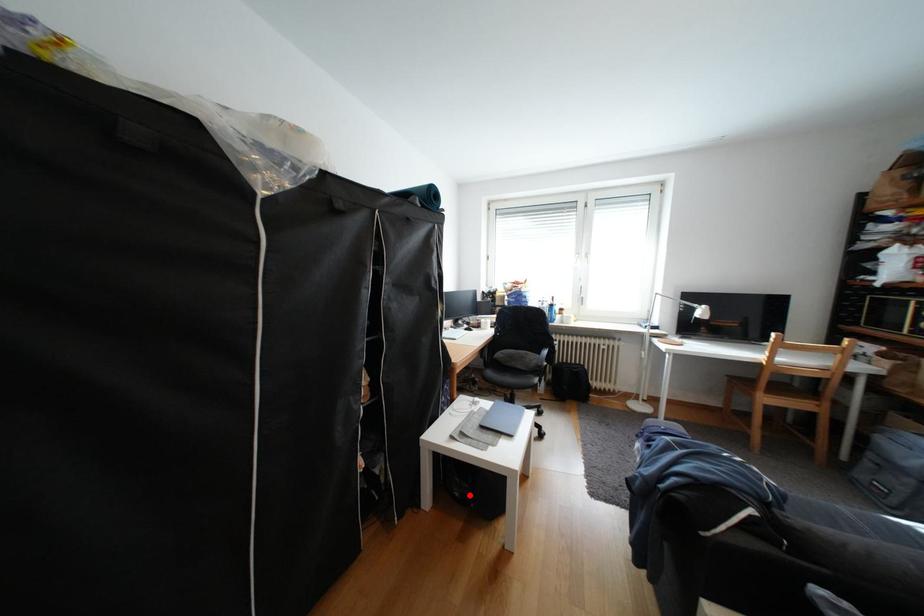
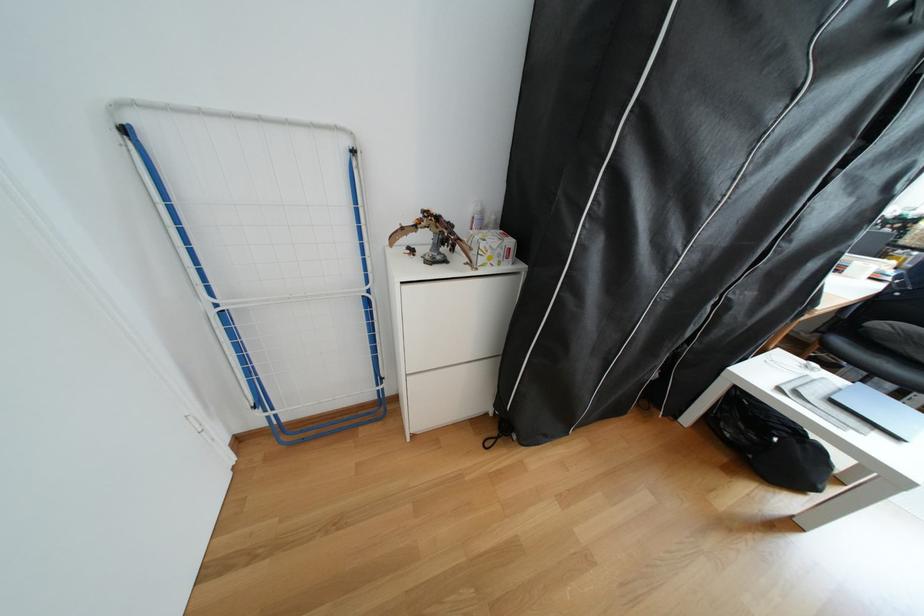
Question: I am providing you with two images of the same scene from different viewpoints. Image1 has a red point marked. In image2, the corresponding 3D location appears at what relative position? Reply with the corresponding letter.

Choices:
 (A) Closer
 (B) Farther

Answer: (A)